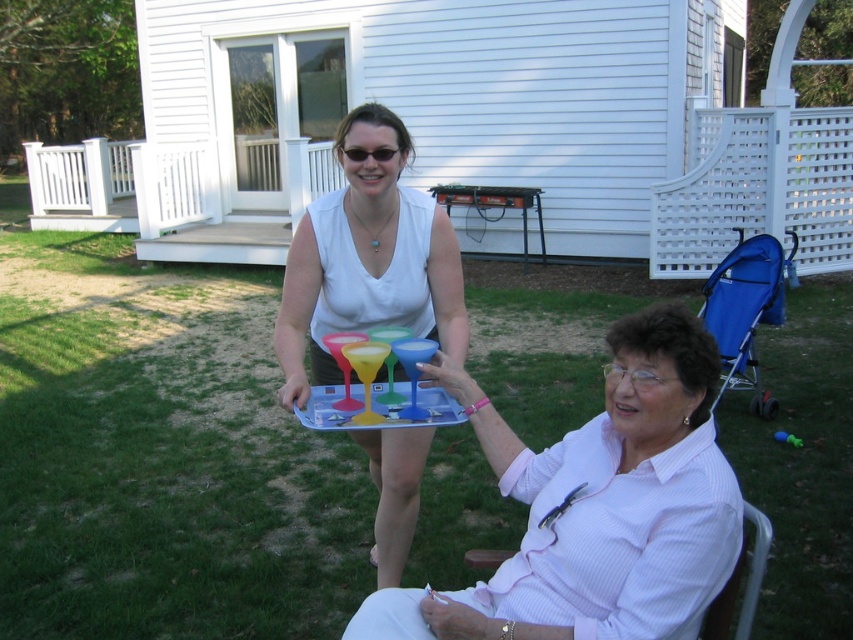
Question: Estimate the real-world distances between objects in this image. Which object is farther from the pink matte plastic glasses at center?

Choices:
 (A) blue fabric folding chair at lower right
 (B) matte plastic glasses at lower right
 (C) transparent plastic tray at center

Answer: (A)

Question: Is the position of matte plastic glasses at lower right more distant than that of pink matte plastic glasses at center?

Choices:
 (A) yes
 (B) no

Answer: (B)

Question: Where is matte plastic glasses at lower right located in relation to translucent plastic tray at center in the image?

Choices:
 (A) left
 (B) right

Answer: (B)

Question: Can you confirm if blue fabric folding chair at lower right is positioned to the right of translucent plastic tray at center?

Choices:
 (A) no
 (B) yes

Answer: (B)

Question: Which point appears closest to the camera in this image?

Choices:
 (A) click(442, 388)
 (B) click(331, 291)

Answer: (A)

Question: Which of the following is the farthest from the observer?

Choices:
 (A) blue fabric folding chair at lower right
 (B) white fabric chair at lower right
 (C) transparent plastic tray at center

Answer: (A)